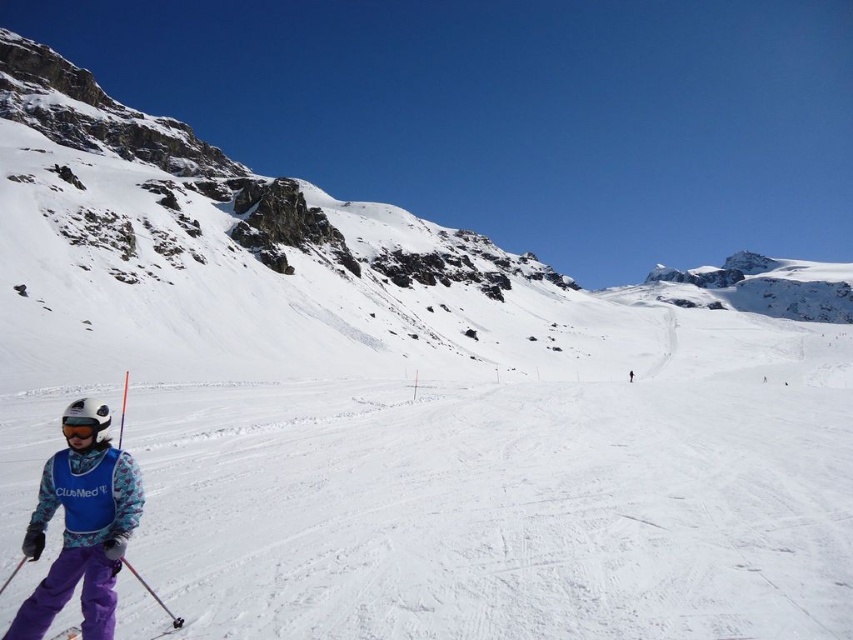
You are a skier on the slope and want to reach the point marked as point (82,628). There is another point marked as point (654,276) on the slope. Which point is closer to your current position if you are at the starting point at the top of the slope?

Point (82,628) is closer to your current position because it is in front of point (654,276).